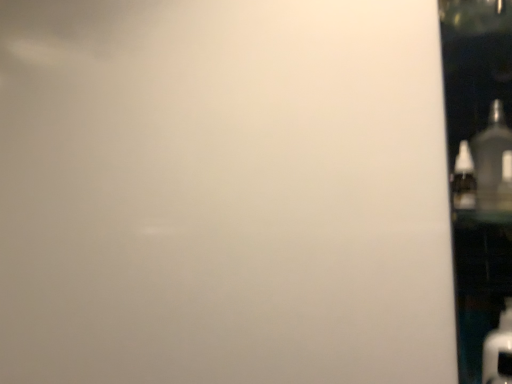
Question: Looking at their shapes, would you say transparent glass door at right is wider or thinner than clear plastic bottle at right, which is counted as the 2th bottle, starting from the right?

Choices:
 (A) wide
 (B) thin

Answer: (A)

Question: Visually, is transparent glass door at right positioned to the left or to the right of clear plastic bottle at right, the 1th bottle from the left?

Choices:
 (A) left
 (B) right

Answer: (B)

Question: Which is nearer to the transparent glass door at right?

Choices:
 (A) clear plastic bottle at right, the 1th bottle from the left
 (B) matte black bottle at right, placed as the 1th bottle when sorted from right to left

Answer: (B)

Question: Considering the real-world distances, which object is closest to the clear plastic bottle at right, which is counted as the 2th bottle, starting from the right?

Choices:
 (A) matte black bottle at right, the 2th bottle viewed from the left
 (B) transparent glass door at right

Answer: (A)